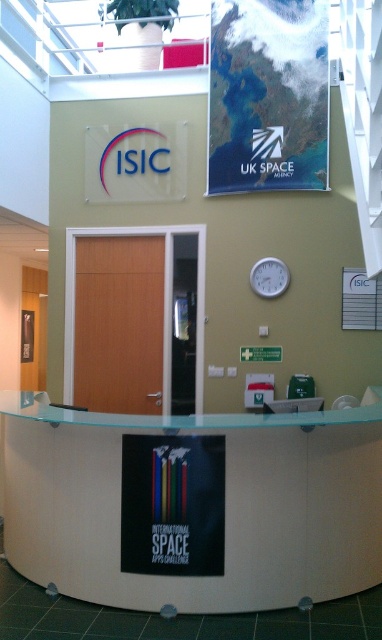
Between white glossy information desk at center and white plastic clock at center, which one has less height?

With less height is white plastic clock at center.

Is white glossy information desk at center behind white plastic clock at center?

No, it is not.

Is point (90, 500) positioned in front of point (270, 260)?

Yes, point (90, 500) is closer to viewer.

The height and width of the screenshot is (640, 382). I want to click on white glossy information desk at center, so click(x=197, y=506).

Can you confirm if white glossy information desk at center is smaller than matte paper poster at upper center?

Incorrect, white glossy information desk at center is not smaller in size than matte paper poster at upper center.

Does white glossy information desk at center appear under matte paper poster at upper center?

Yes, white glossy information desk at center is below matte paper poster at upper center.

Where is `white glossy information desk at center`? white glossy information desk at center is located at coordinates (197, 506).

Can you confirm if matte paper poster at upper center is taller than white plastic clock at center?

Correct, matte paper poster at upper center is much taller as white plastic clock at center.

The width and height of the screenshot is (382, 640). What are the coordinates of `matte paper poster at upper center` in the screenshot? It's located at 268,96.

Locate an element on the screen. matte paper poster at upper center is located at coordinates (268, 96).